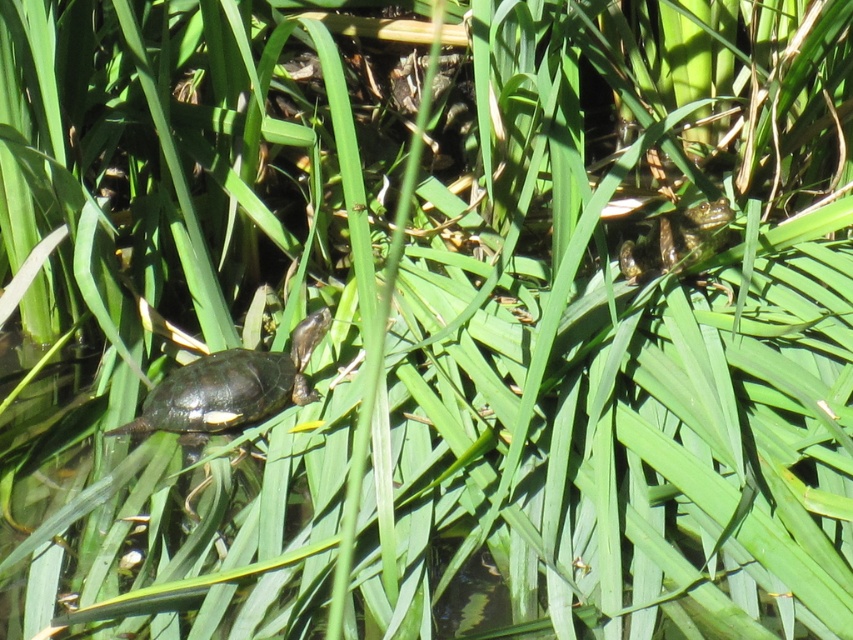
Does shiny black tortoise at left have a lesser height compared to green scaly tortoise at upper right?

No.

Between point (181, 428) and point (624, 266), which one is positioned behind?

The point (624, 266) is behind.

Which is behind, point (312, 394) or point (701, 243)?

Point (701, 243)

Identify the location of shiny black tortoise at left. (230, 387).